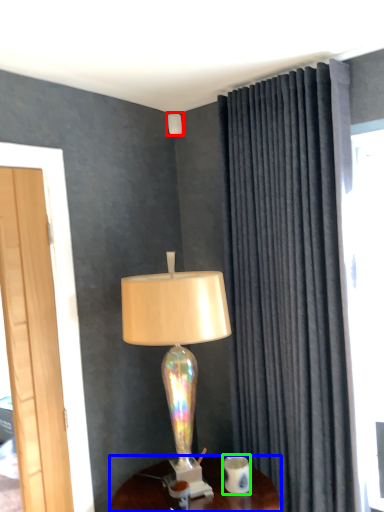
Question: Which object is the farthest from lamp (highlighted by a red box)? Choose among these: desk (highlighted by a blue box) or coffee cup (highlighted by a green box).

Choices:
 (A) desk
 (B) coffee cup

Answer: (A)